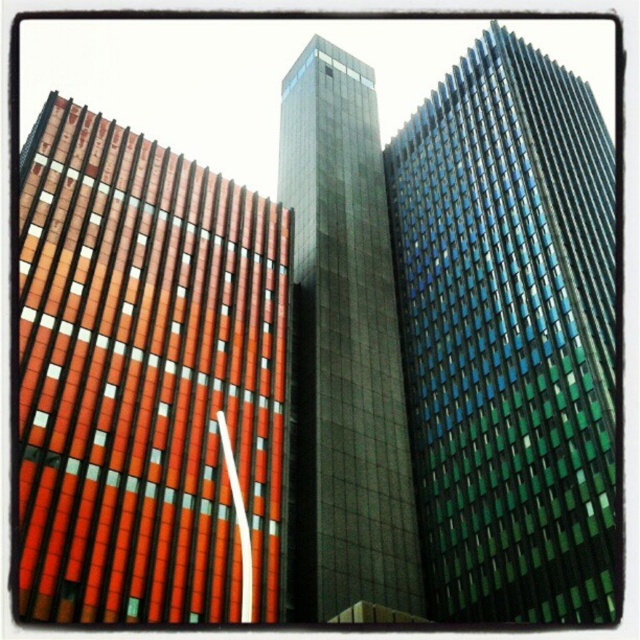
Question: Which object appears closest to the camera in this image?

Choices:
 (A) blue-green glass facade at center
 (B) orange brick building at left

Answer: (B)

Question: Can you confirm if blue-green glass facade at center is positioned to the left of dark glass tower at center?

Choices:
 (A) yes
 (B) no

Answer: (B)

Question: Is orange brick building at left thinner than blue-green glass facade at center?

Choices:
 (A) yes
 (B) no

Answer: (A)

Question: Is orange brick building at left closer to the viewer compared to blue-green glass facade at center?

Choices:
 (A) no
 (B) yes

Answer: (B)

Question: Estimate the real-world distances between objects in this image. Which object is farther from the dark glass tower at center?

Choices:
 (A) blue-green glass facade at center
 (B) orange brick building at left

Answer: (B)

Question: Among these objects, which one is farthest from the camera?

Choices:
 (A) dark glass tower at center
 (B) orange brick building at left

Answer: (A)